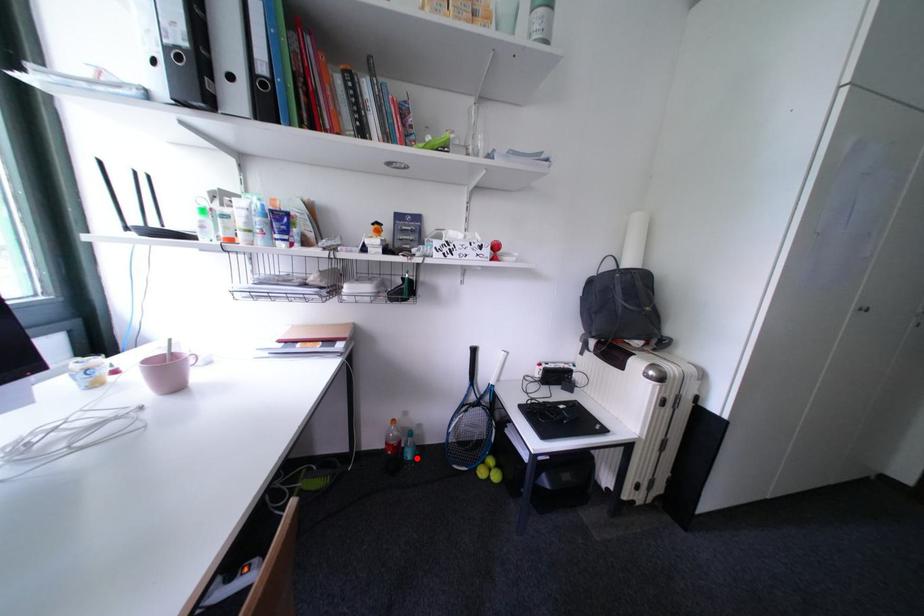
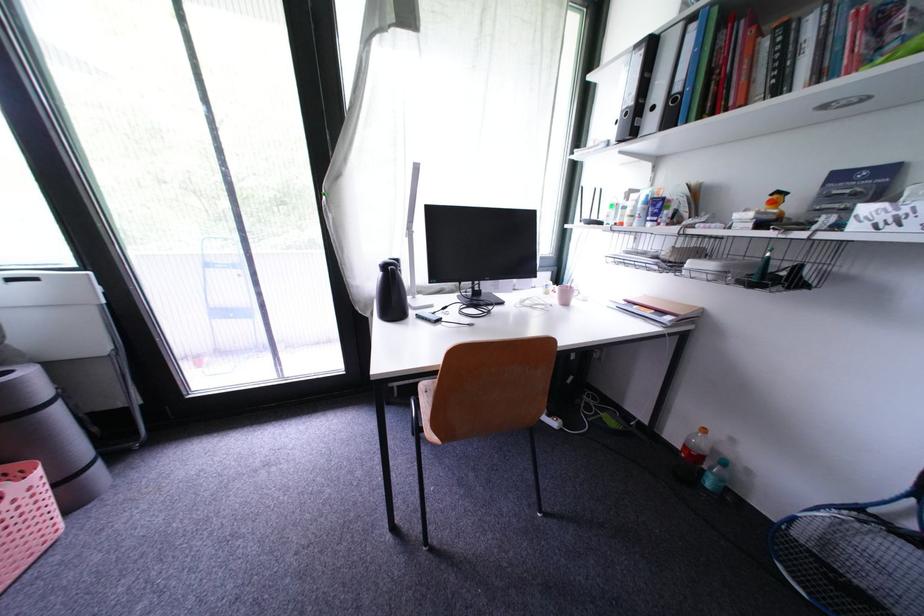
The point at the highlighted location is marked in the first image. Where is the corresponding point in the second image?

(718, 485)